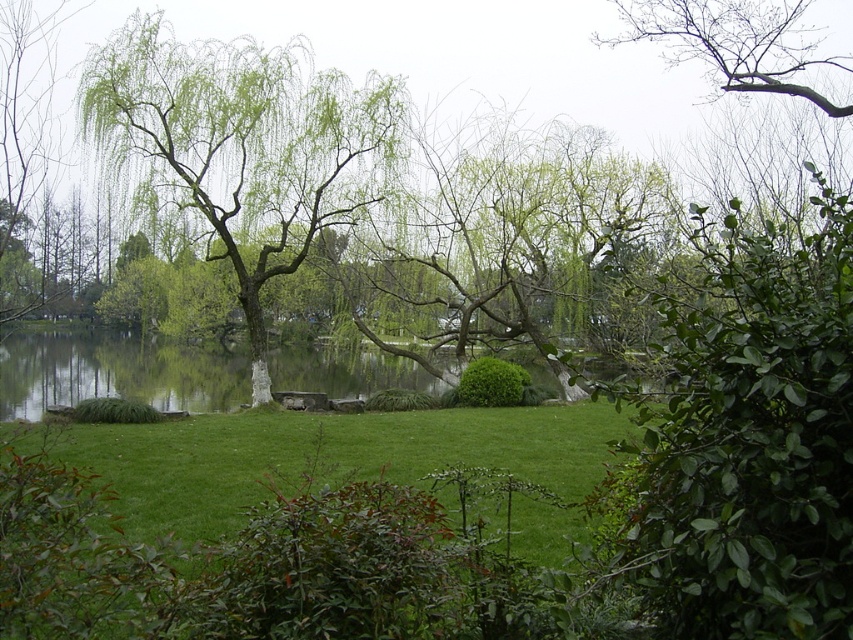
Can you confirm if green leafy willow at center is shorter than bare branches at upper right?

Yes, green leafy willow at center is shorter than bare branches at upper right.

Is point (341, 172) positioned before point (791, 4)?

No, it is behind (791, 4).

The width and height of the screenshot is (853, 640). What do you see at coordinates (242, 145) in the screenshot?
I see `green leafy willow at center` at bounding box center [242, 145].

This screenshot has width=853, height=640. In order to click on green leafy willow at center in this screenshot , I will do `click(242, 145)`.

Is green leafy willow at center bigger than green grassy lake at center?

Actually, green leafy willow at center might be smaller than green grassy lake at center.

Identify the location of green leafy willow at center. This screenshot has width=853, height=640. (242, 145).

Find the location of a particular element. The width and height of the screenshot is (853, 640). green leafy willow at center is located at coordinates (242, 145).

Between green grassy lake at center and bare branches at upper right, which one has less height?

With less height is green grassy lake at center.

Can you confirm if green grassy lake at center is thinner than bare branches at upper right?

No.

Who is more distant from viewer, (x=9, y=365) or (x=781, y=8)?

Point (x=9, y=365)

Where is `green grassy lake at center`? The height and width of the screenshot is (640, 853). green grassy lake at center is located at coordinates (114, 372).